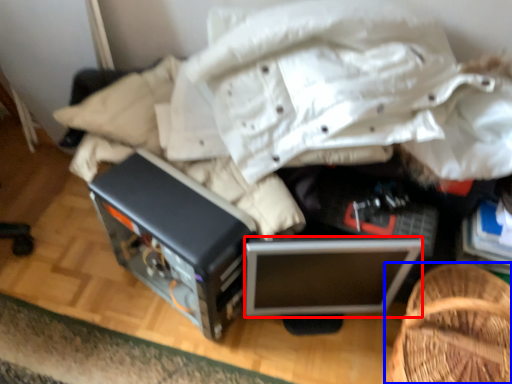
Question: Which point is further to the camera, computer (highlighted by a red box) or furniture (highlighted by a blue box)?

Choices:
 (A) computer
 (B) furniture

Answer: (A)